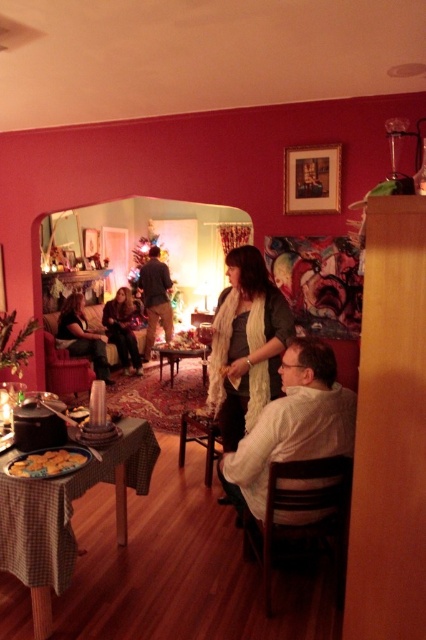
You are organizing a small dinner party and need to seat guests around the table. You notice the white matte shirt at lower right and the dark gray sweater at center. Which clothing item takes up more horizontal space on the table?

The white matte shirt at lower right might be wider than dark gray sweater at center, so it likely occupies more horizontal space on the table.

You are a guest at this cozy indoor gathering. You notice two items on the table, the white matte shirt at lower right and the dark gray sweater at center. Which item is closer to you as you look at the table?

The white matte shirt at lower right is closer to you because it is in front of the dark gray sweater at center.